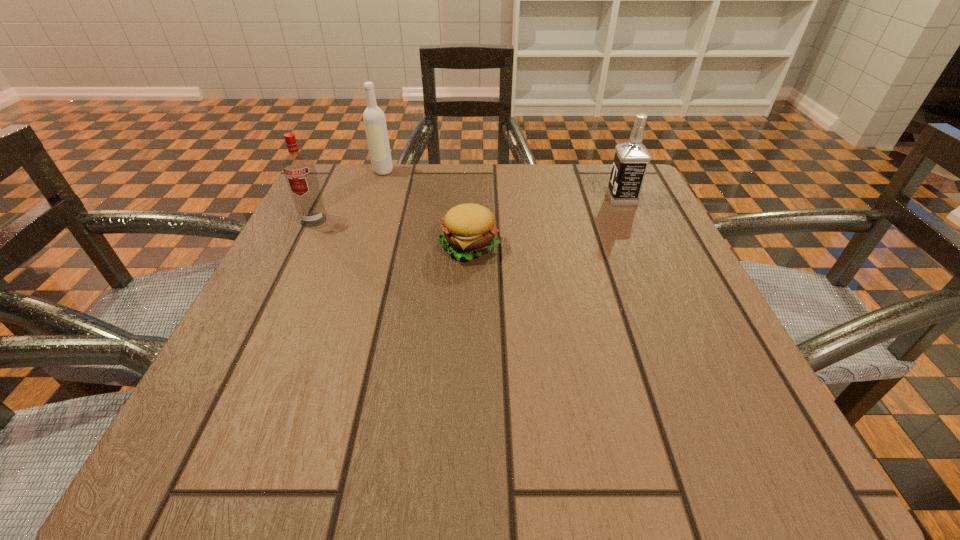
The height and width of the screenshot is (540, 960). In order to click on vacant region between the rightmost object and the second vodka from left to right in this screenshot , I will do `click(502, 185)`.

Locate which object is the closest to the rightmost vodka. Please provide its 2D coordinates. Your answer should be formatted as a tuple, i.e. [(x, y)], where the tuple contains the x and y coordinates of a point satisfying the conditions above.

[(468, 231)]

Choose which object is the nearest neighbor to the third object from right to left. Please provide its 2D coordinates. Your answer should be formatted as a tuple, i.e. [(x, y)], where the tuple contains the x and y coordinates of a point satisfying the conditions above.

[(299, 169)]

Identify the location of the closest vodka to the farthest object. Image resolution: width=960 pixels, height=540 pixels. (299, 169).

Choose which vodka is the nearest neighbor to the second nearest object. Please provide its 2D coordinates. Your answer should be formatted as a tuple, i.e. [(x, y)], where the tuple contains the x and y coordinates of a point satisfying the conditions above.

[(374, 119)]

This screenshot has height=540, width=960. Identify the location of vacant space that satisfies the following two spatial constraints: 1. on the front label of the rightmost object; 2. on the front label of the third farthest object. (632, 220).

The width and height of the screenshot is (960, 540). I want to click on vacant space that satisfies the following two spatial constraints: 1. on the front label of the hamburger; 2. on the left side of the leftmost vodka, so click(301, 246).

Where is `free location that satisfies the following two spatial constraints: 1. on the front label of the rightmost vodka; 2. on the front label of the leftmost object`? The height and width of the screenshot is (540, 960). free location that satisfies the following two spatial constraints: 1. on the front label of the rightmost vodka; 2. on the front label of the leftmost object is located at coordinates (632, 220).